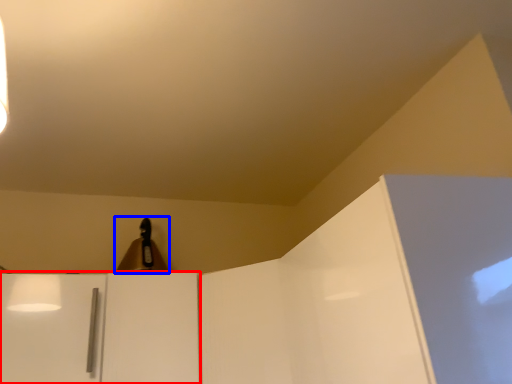
Question: Which point is further to the camera, cabinetry (highlighted by a red box) or lamp (highlighted by a blue box)?

Choices:
 (A) cabinetry
 (B) lamp

Answer: (B)